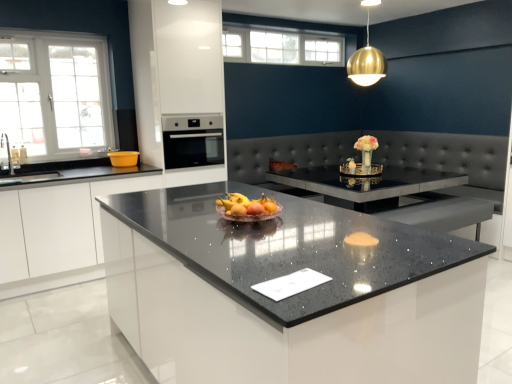
Question: Which is correct: satin black oven at center is inside white glossy cabinet at left, or outside of it?

Choices:
 (A) inside
 (B) outside

Answer: (B)

Question: From the image's perspective, is satin black oven at center located above or below white glossy cabinet at left?

Choices:
 (A) above
 (B) below

Answer: (A)

Question: Based on their relative distances, which object is farther from the white glass window at upper left, which is the 2th window from back to front?

Choices:
 (A) white glossy cabinet at left
 (B) white glass window at upper center, arranged as the second window when viewed from the front
 (C) sparkling granite countertop at center
 (D) gold metallic sphere at upper center
 (E) satin black oven at center

Answer: (D)

Question: Based on their relative distances, which object is farther from the sparkling granite countertop at center?

Choices:
 (A) white glass window at upper left, which is the 2th window from back to front
 (B) white glass window at upper center, placed as the second window when sorted from bottom to top
 (C) white glossy cabinet at left
 (D) satin black oven at center
 (E) gold metallic sphere at upper center

Answer: (B)